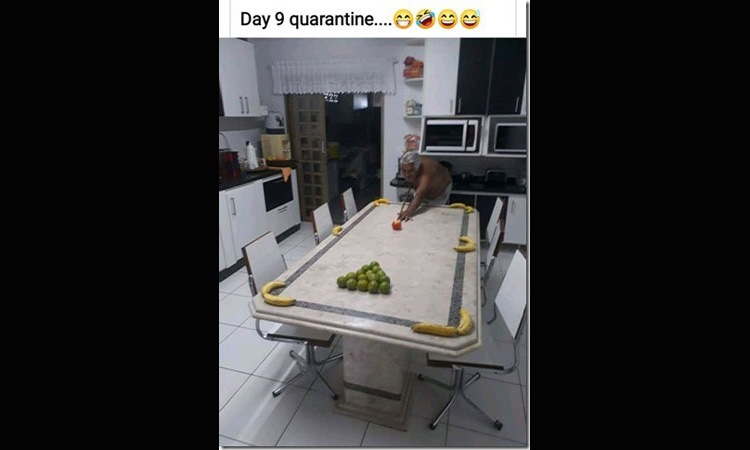
Where is `kitchen cupboard`? kitchen cupboard is located at coordinates (229, 85).